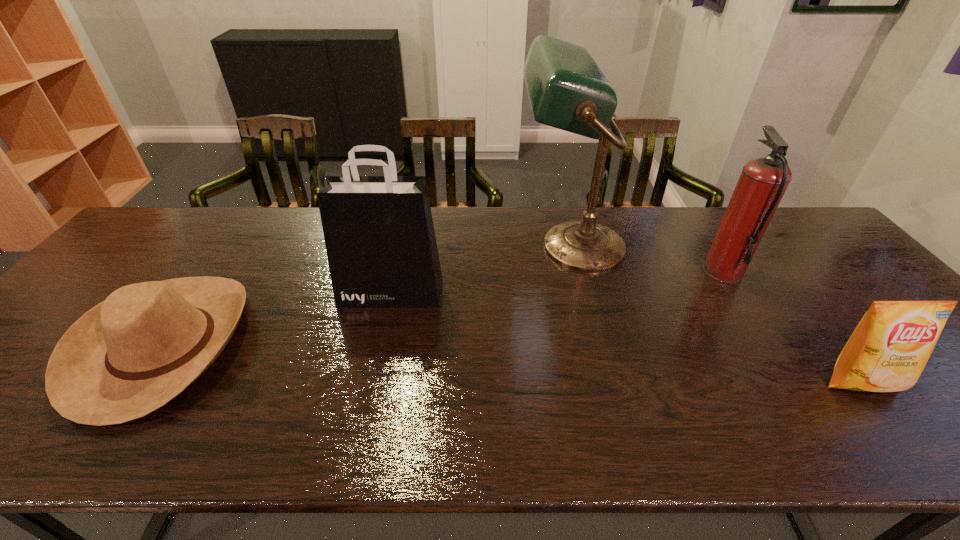
Image resolution: width=960 pixels, height=540 pixels. What are the coordinates of `vacant point located 0.100m above the green lampshade of the table lamp` in the screenshot? It's located at (485, 247).

Identify the location of free spot located on the front with handles of the second object from left to right. The height and width of the screenshot is (540, 960). (371, 386).

The width and height of the screenshot is (960, 540). What are the coordinates of `vacant space positioned at the nozzle of the fourth object from left to right` in the screenshot? It's located at (585, 272).

At what (x,y) coordinates should I click in order to perform the action: click on free space located at the nozzle of the fourth object from left to right. Please return your answer as a coordinate pair (x, y). Looking at the image, I should click on (574, 272).

Identify the location of free space located at the nozzle of the fourth object from left to right. (686, 272).

Find the location of a particular element. free location located on the front-facing side of the shortest object is located at coordinates (395, 345).

The height and width of the screenshot is (540, 960). What are the coordinates of `object that is at the far edge` in the screenshot? It's located at (567, 90).

Identify the location of object at the near edge. This screenshot has width=960, height=540. (132, 353).

Identify the location of object that is positioned at the left edge. The image size is (960, 540). (132, 353).

I want to click on object situated at the right edge, so click(887, 352).